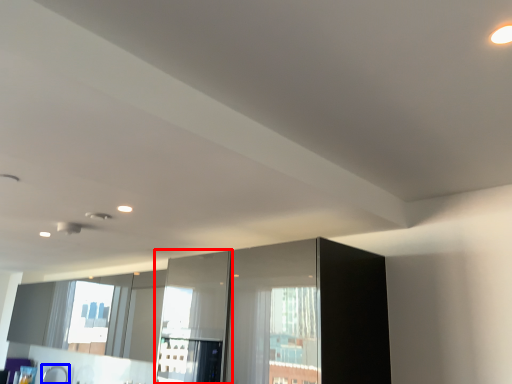
Question: Which object is further to the camera taking this photo, screen door (highlighted by a red box) or faucet (highlighted by a blue box)?

Choices:
 (A) screen door
 (B) faucet

Answer: (B)